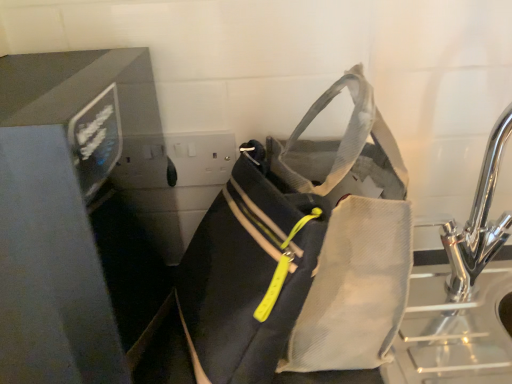
Question: Do you think matte black bag at center is within matte black monitor at left, or outside of it?

Choices:
 (A) outside
 (B) inside

Answer: (A)

Question: Considering their positions, is matte black bag at center located in front of or behind matte black monitor at left?

Choices:
 (A) front
 (B) behind

Answer: (B)

Question: Based on their relative distances, which object is nearer to the matte black bag at center?

Choices:
 (A) matte black monitor at left
 (B) chrome metallic sink at right

Answer: (A)

Question: Which object is positioned closest to the matte black bag at center?

Choices:
 (A) chrome metallic sink at right
 (B) matte black monitor at left

Answer: (B)